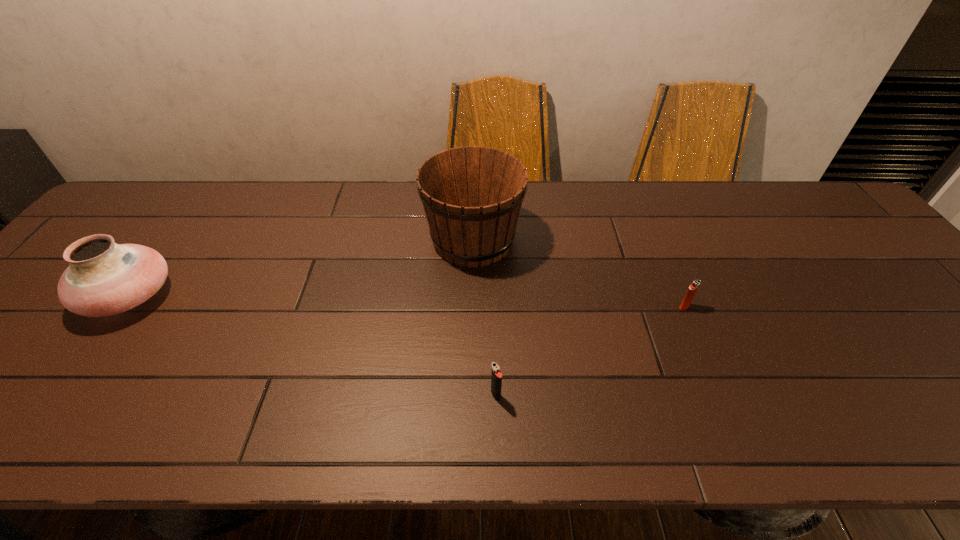
Locate an element on the screen. This screenshot has height=540, width=960. free spot between the right igniter and the third shortest object is located at coordinates (407, 302).

Identify the location of free spot between the second tallest object and the tallest object. (301, 268).

Find the location of a particular element. The width and height of the screenshot is (960, 540). free point between the rightmost object and the tallest object is located at coordinates (579, 273).

You are a GUI agent. You are given a task and a screenshot of the screen. Output one action in this format:
    pyautogui.click(x=<x>, y=<y>)
    Task: Click on the vacant region between the right igniter and the leftmost object
    This screenshot has height=540, width=960.
    Given the screenshot: What is the action you would take?
    pyautogui.click(x=407, y=302)

What are the coordinates of `free area in between the leftmost object and the shorter igniter` in the screenshot? It's located at (407, 302).

You are a GUI agent. You are given a task and a screenshot of the screen. Output one action in this format:
    pyautogui.click(x=<x>, y=<y>)
    Task: Click on the free space between the leftmost object and the left igniter
    
    Given the screenshot: What is the action you would take?
    pyautogui.click(x=313, y=346)

Identify the location of vacant area between the nearer igniter and the farther igniter. (590, 351).

Select which object is the closest to the leftmost object. Please provide its 2D coordinates. Your answer should be formatted as a tuple, i.e. [(x, y)], where the tuple contains the x and y coordinates of a point satisfying the conditions above.

[(472, 196)]

Choose which object is the nearest neighbor to the nearest object. Please provide its 2D coordinates. Your answer should be formatted as a tuple, i.e. [(x, y)], where the tuple contains the x and y coordinates of a point satisfying the conditions above.

[(472, 196)]